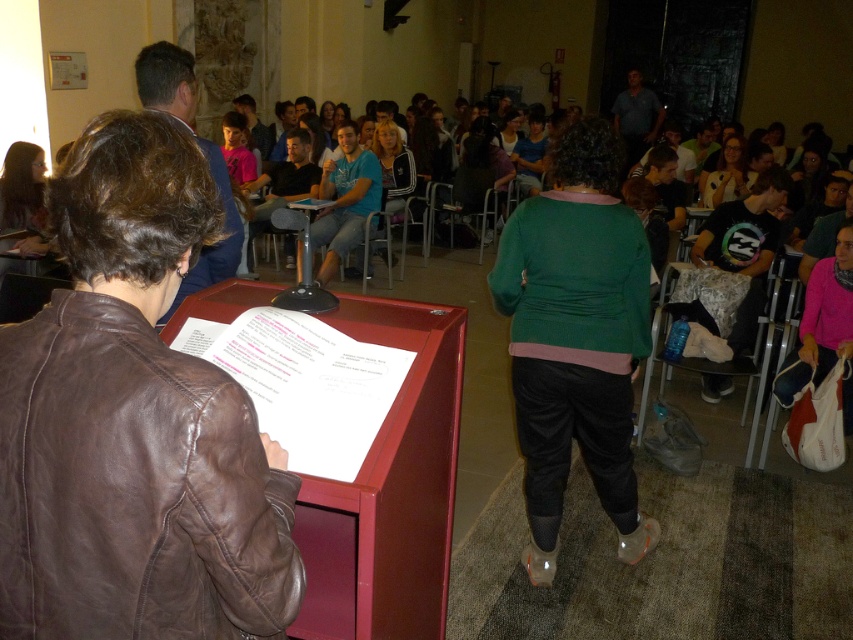
Question: Considering the real-world distances, which object is closest to the leather jacket at left?

Choices:
 (A) dark brown leather jacket at left
 (B) matte red podium at center
 (C) metallic silver chair at center

Answer: (B)

Question: Which object is positioned closest to the leather jacket at left?

Choices:
 (A) metallic gray chair at center
 (B) black fabric chair at lower right

Answer: (B)

Question: In this image, where is matte red podium at center located relative to metallic gray chair at center?

Choices:
 (A) below
 (B) above

Answer: (A)

Question: Does black fabric chair at lower right appear on the right side of metallic gray chair at center?

Choices:
 (A) no
 (B) yes

Answer: (B)

Question: Which of the following is the closest to the observer?

Choices:
 (A) dark brown leather jacket at left
 (B) metallic silver table at center

Answer: (A)

Question: Is metallic gray chair at center smaller than matte black glasses at upper right?

Choices:
 (A) yes
 (B) no

Answer: (A)